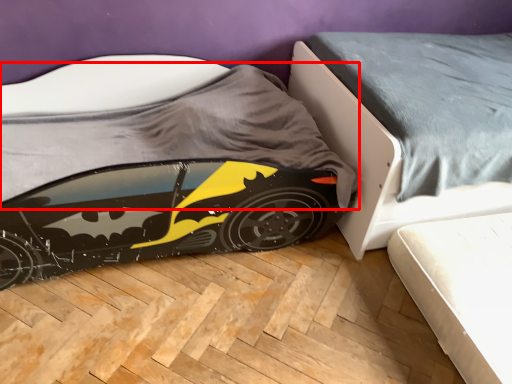
Question: From the image's perspective, where is sheet (annotated by the red box) located relative to bed?

Choices:
 (A) below
 (B) above

Answer: (A)